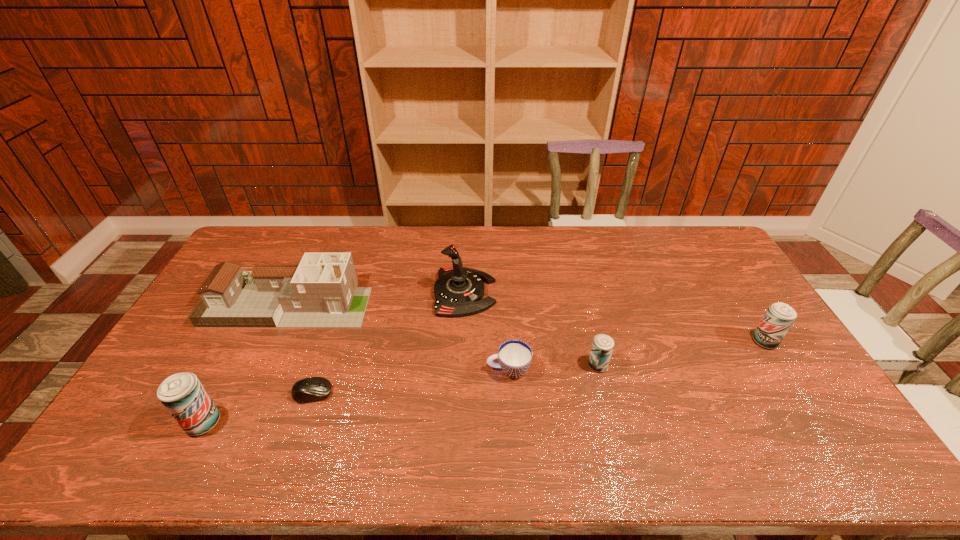
This screenshot has width=960, height=540. Identify the location of vacant area that lies between the second farthest beer can and the second shortest object. (553, 368).

You are a GUI agent. You are given a task and a screenshot of the screen. Output one action in this format:
    pyautogui.click(x=<x>, y=<y>)
    Task: Click on the free spot between the second farthest beer can and the fifth nearest object
    
    Given the screenshot: What is the action you would take?
    click(x=682, y=353)

The width and height of the screenshot is (960, 540). I want to click on free space between the tallest beer can and the joystick, so click(x=334, y=357).

This screenshot has width=960, height=540. What are the coordinates of `free spot between the mouse and the leftmost beer can` in the screenshot? It's located at (258, 408).

At what (x,y) coordinates should I click in order to perform the action: click on vacant space that is in between the second beer can from left to right and the dollhouse. Please return your answer as a coordinate pair (x, y). Image resolution: width=960 pixels, height=540 pixels. Looking at the image, I should click on (444, 335).

Where is `empty space that is in between the cup and the joystick`? Image resolution: width=960 pixels, height=540 pixels. empty space that is in between the cup and the joystick is located at coordinates (487, 331).

Where is `free spot between the shortest object and the leftmost beer can`? The width and height of the screenshot is (960, 540). free spot between the shortest object and the leftmost beer can is located at coordinates (258, 408).

I want to click on vacant space that is in between the sixth tallest object and the shortest object, so click(411, 382).

Find the location of a particular element. The height and width of the screenshot is (540, 960). vacant area that lies between the mouse and the joystick is located at coordinates (389, 343).

Identify the location of free spot between the farthest beer can and the dollhouse. click(527, 323).